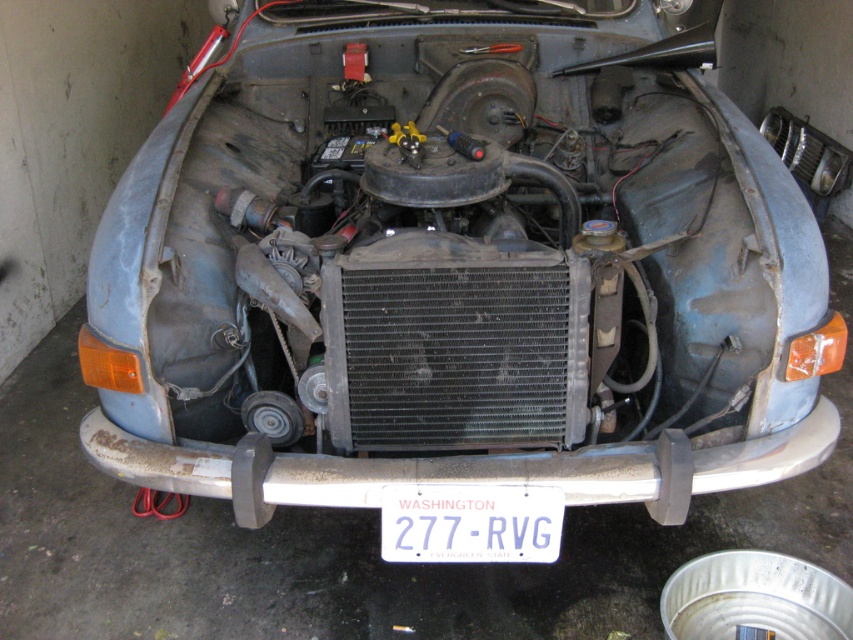
Does metallic silver bumper at center have a lesser width compared to white plastic license plate at center?

No, metallic silver bumper at center is not thinner than white plastic license plate at center.

Can you confirm if metallic silver bumper at center is positioned to the left of white plastic license plate at center?

Yes, metallic silver bumper at center is to the left of white plastic license plate at center.

Does point (343, 499) come in front of point (413, 500)?

That is False.

Find the location of a particular element. metallic silver bumper at center is located at coordinates (460, 468).